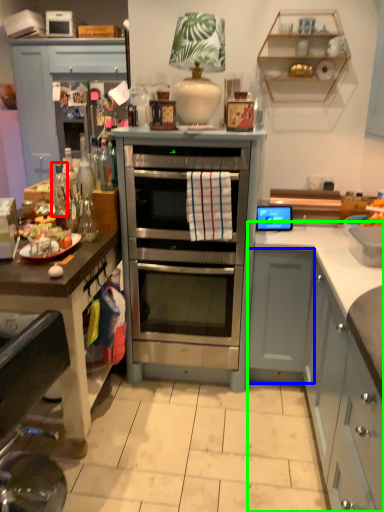
Question: Based on their relative distances, which object is farther from bottle (highlighted by a red box)? Choose from cabinetry (highlighted by a blue box) and cabinetry (highlighted by a green box).

Choices:
 (A) cabinetry
 (B) cabinetry

Answer: (B)